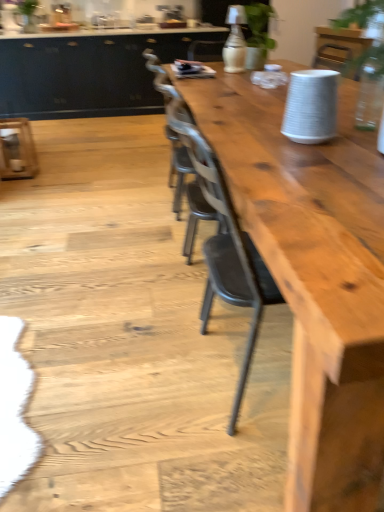
Question: Can we say natural wood table at center lies outside matte black cabinetry at upper left?

Choices:
 (A) yes
 (B) no

Answer: (A)

Question: Could you tell me if natural wood table at center is turned towards matte black cabinetry at upper left?

Choices:
 (A) yes
 (B) no

Answer: (A)

Question: From a real-world perspective, is natural wood table at center on top of matte black cabinetry at upper left?

Choices:
 (A) no
 (B) yes

Answer: (A)

Question: Considering the relative sizes of natural wood table at center and matte black cabinetry at upper left in the image provided, is natural wood table at center thinner than matte black cabinetry at upper left?

Choices:
 (A) yes
 (B) no

Answer: (B)

Question: Is natural wood table at center facing away from matte black cabinetry at upper left?

Choices:
 (A) yes
 (B) no

Answer: (B)

Question: From a real-world perspective, is natural wood table at center positioned under matte black cabinetry at upper left based on gravity?

Choices:
 (A) no
 (B) yes

Answer: (B)

Question: Can you confirm if matte black cabinetry at upper left is thinner than natural wood table at center?

Choices:
 (A) no
 (B) yes

Answer: (B)

Question: Is matte black cabinetry at upper left at the right side of natural wood table at center?

Choices:
 (A) yes
 (B) no

Answer: (B)

Question: Is matte black cabinetry at upper left shorter than natural wood table at center?

Choices:
 (A) yes
 (B) no

Answer: (B)

Question: From a real-world perspective, is matte black cabinetry at upper left on natural wood table at center?

Choices:
 (A) yes
 (B) no

Answer: (A)

Question: Can we say matte black cabinetry at upper left lies outside natural wood table at center?

Choices:
 (A) yes
 (B) no

Answer: (A)

Question: Are matte black cabinetry at upper left and natural wood table at center making contact?

Choices:
 (A) yes
 (B) no

Answer: (B)

Question: Considering the positions of matte black cabinetry at upper left and natural wood table at center in the image, is matte black cabinetry at upper left bigger or smaller than natural wood table at center?

Choices:
 (A) small
 (B) big

Answer: (B)